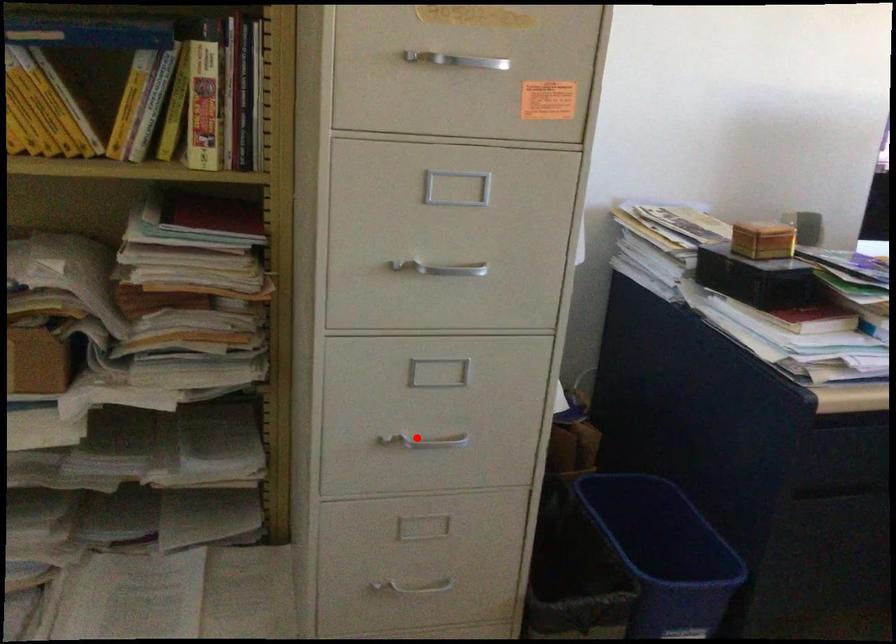
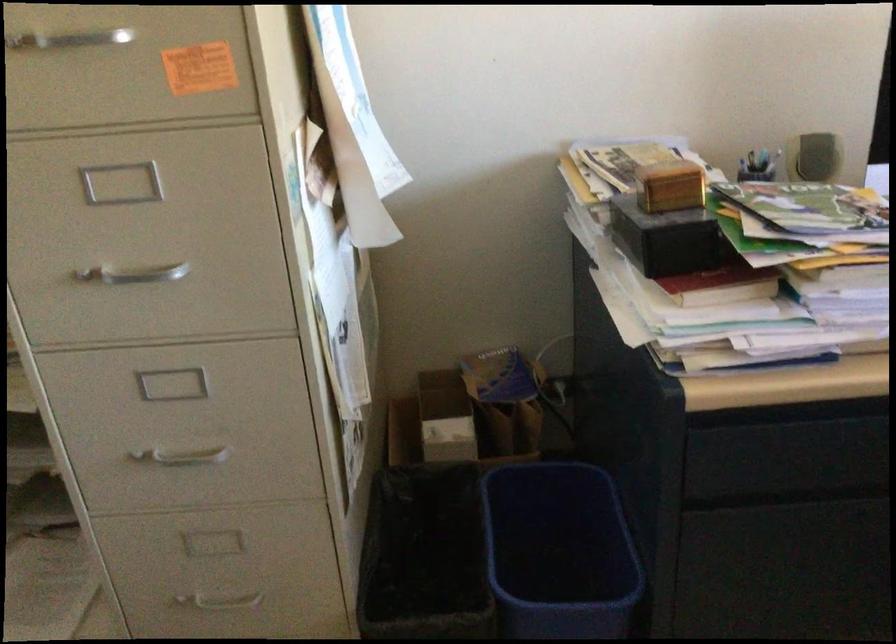
The point at the highlighted location is marked in the first image. Where is the corresponding point in the second image?

(181, 456)